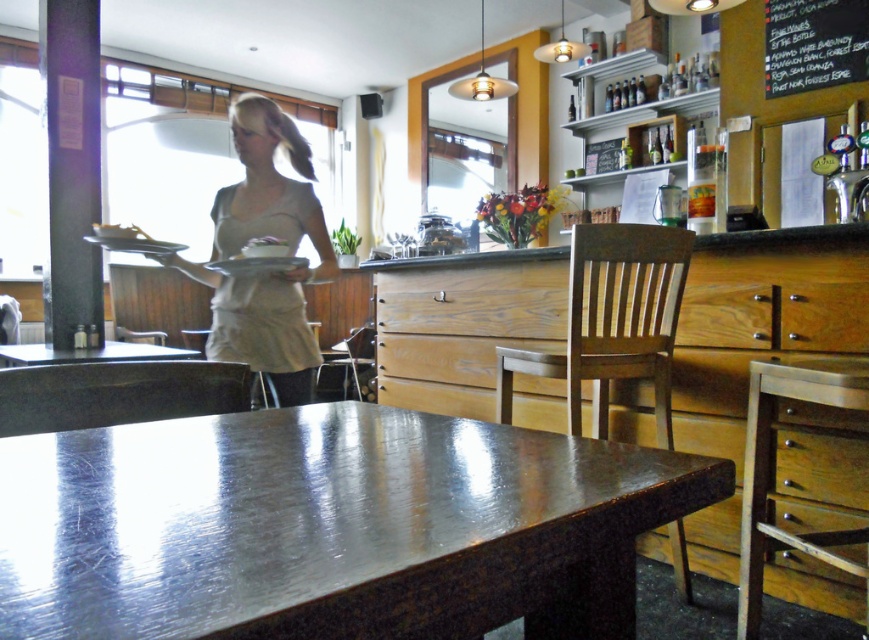
You are a customer sitting at the wooden chair at center and want to reach the metallic polished chair at lower center. Which direction should you move to get there?

The wooden chair at center is positioned on the right side of metallic polished chair at lower center, so you should move to the left to reach it.

You are a customer at the shiny metallic table at center and want to reach the matte white platter at center to grab a bread roll. Which direction should you move to reach it?

The shiny metallic table at center is positioned on the right side of matte white platter at center, so you should move to your left to reach the matte white platter at center.